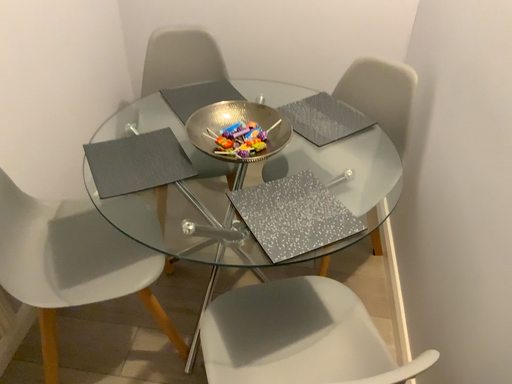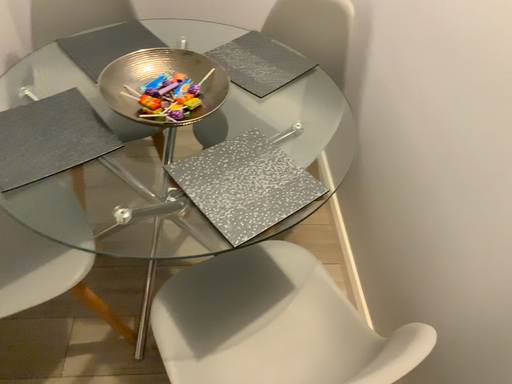
Question: How did the camera likely rotate when shooting the video?

Choices:
 (A) rotated downward
 (B) rotated upward

Answer: (A)